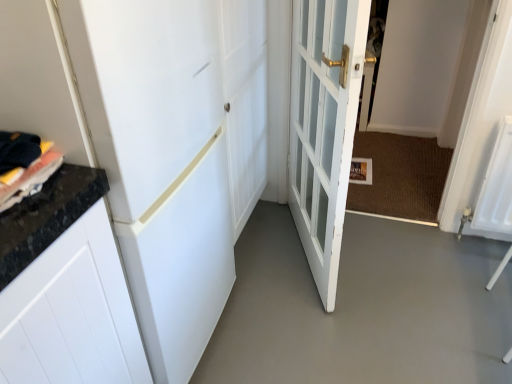
Question: Relative to white matte door at upper left, positioned as the first door in left-to-right order, is gray smooth concrete at center in front or behind?

Choices:
 (A) front
 (B) behind

Answer: (B)

Question: In terms of width, does gray smooth concrete at center look wider or thinner when compared to white matte door at upper left, which is counted as the second door, starting from the right?

Choices:
 (A) thin
 (B) wide

Answer: (B)

Question: Estimate the real-world distances between objects in this image. Which object is closer to the gray smooth concrete at center?

Choices:
 (A) white matte door at upper left, positioned as the first door in left-to-right order
 (B) white glass door at center, which appears as the 1th door when viewed from the right

Answer: (B)

Question: Which of these objects is positioned closest to the gray smooth concrete at center?

Choices:
 (A) white glass door at center, the second door positioned from the left
 (B) white matte door at upper left, positioned as the first door in left-to-right order

Answer: (A)